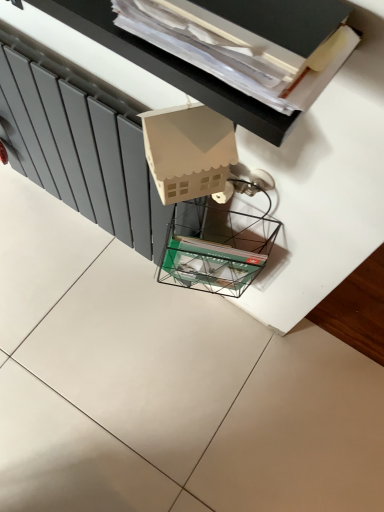
Question: From the image's perspective, is matte gray radiator at left positioned above or below matte cardboard house at upper center?

Choices:
 (A) below
 (B) above

Answer: (A)

Question: Considering the positions of matte gray radiator at left and matte cardboard house at upper center in the image, is matte gray radiator at left wider or thinner than matte cardboard house at upper center?

Choices:
 (A) thin
 (B) wide

Answer: (A)

Question: Estimate the real-world distances between objects in this image. Which object is closer to the matte cardboard house at upper center?

Choices:
 (A) clear glass magazine rack at center
 (B) matte gray radiator at left

Answer: (B)

Question: Which object is positioned closest to the clear glass magazine rack at center?

Choices:
 (A) matte gray radiator at left
 (B) matte cardboard house at upper center

Answer: (A)